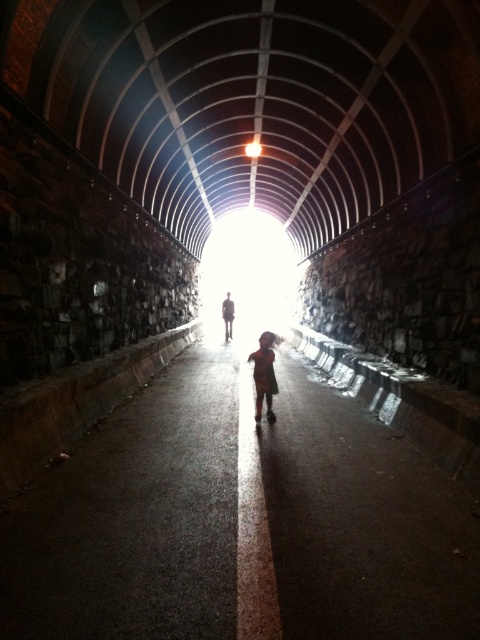
You are driving a delivery truck that is 2 meters wide. You see the dark brown fabric child at center and the bright white light at center in the tunnel. Can your truck pass through the space between them?

The dark brown fabric child at center is thinner than the bright white light at center, but the exact width of the space between them isn not specified. Without knowing the distance between the two objects, it is impossible to determine if the truck can pass.

You are driving a delivery van that is 2 meters wide. You need to exit the tunnel through the light at the far end. Can your van pass through the space between the dark brown fabric child at center and the silhouette figure at center?

The dark brown fabric child at center is thinner than the silhouette figure at center, so the space between them may be wide enough for the van. However, since the exact distance isn not provided, it is uncertain. Proceed with caution.